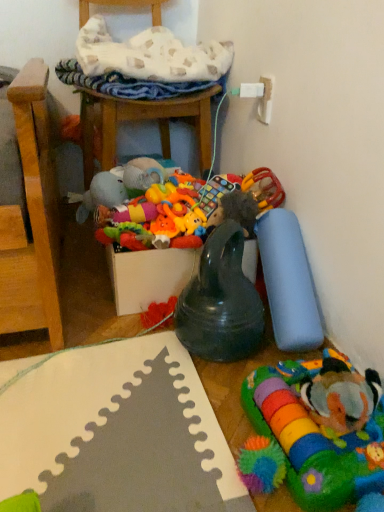
Question: Considering the relative positions of soft plush toy at center, placed as the fifth toy when sorted from right to left, and rubberized plastic rattle at right, which ranks as the 3th toy in right-to-left order, in the image provided, is soft plush toy at center, placed as the fifth toy when sorted from right to left, to the left or to the right of rubberized plastic rattle at right, which ranks as the 3th toy in right-to-left order,?

Choices:
 (A) right
 (B) left

Answer: (B)

Question: Considering the positions of soft plush toy at center, acting as the 1th toy starting from the left, and rubberized plastic rattle at right, which ranks as the 3th toy in right-to-left order, in the image, is soft plush toy at center, acting as the 1th toy starting from the left, wider or thinner than rubberized plastic rattle at right, which ranks as the 3th toy in right-to-left order,?

Choices:
 (A) thin
 (B) wide

Answer: (B)

Question: Estimate the real-world distances between objects in this image. Which object is farther from the soft plush clownfish at lower right, marked as the 1th toy in a right-to-left arrangement?

Choices:
 (A) rubberized plastic rattle at right, which ranks as the 3th toy in right-to-left order
 (B) multicolored plush toy at lower right, marked as the 4th toy in a left-to-right arrangement
 (C) wooden chair at upper center
 (D) rubberized black teething ring at center, the second toy from the left
 (E) soft plush toy at center, placed as the fifth toy when sorted from right to left

Answer: (C)

Question: Based on their relative distances, which object is nearer to the rubberized plastic rattle at right, placed as the third toy when sorted from left to right?

Choices:
 (A) multicolored plush toy at lower right, which appears as the second toy when viewed from the right
 (B) rubberized black teething ring at center, the second toy from the left
 (C) wooden chair at upper center
 (D) soft plush clownfish at lower right, marked as the fifth toy in a left-to-right arrangement
 (E) soft plush toy at center, placed as the fifth toy when sorted from right to left

Answer: (B)